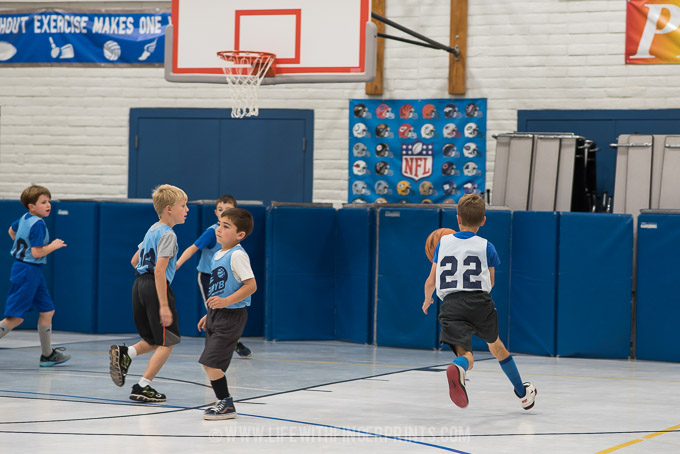
You are a GUI agent. You are given a task and a screenshot of the screen. Output one action in this format:
    pyautogui.click(x=<x>, y=<y>)
    Task: Click on the blue padding
    This screenshot has height=454, width=680.
    Given the screenshot: What is the action you would take?
    pyautogui.click(x=321, y=262), pyautogui.click(x=396, y=262), pyautogui.click(x=611, y=267), pyautogui.click(x=660, y=277), pyautogui.click(x=181, y=282), pyautogui.click(x=75, y=258)